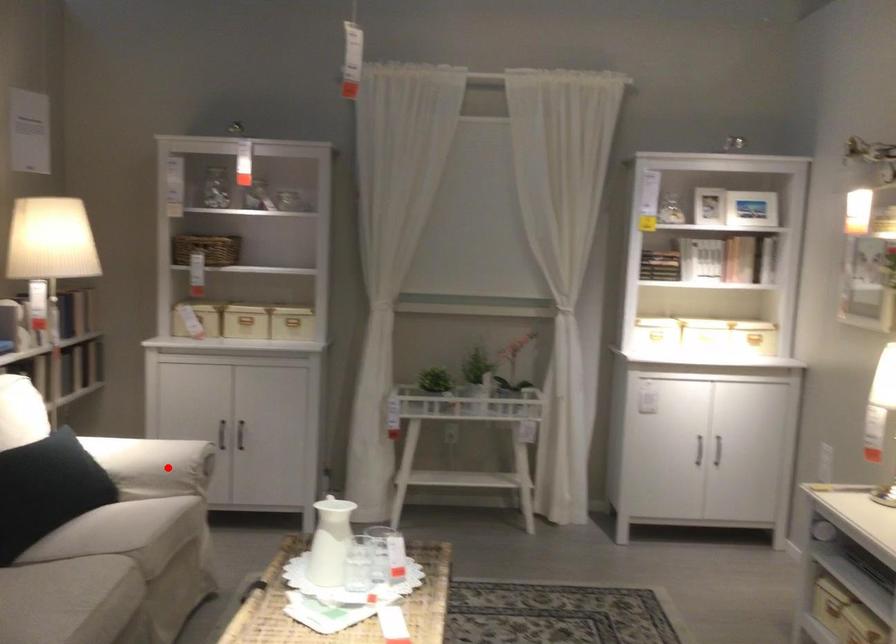
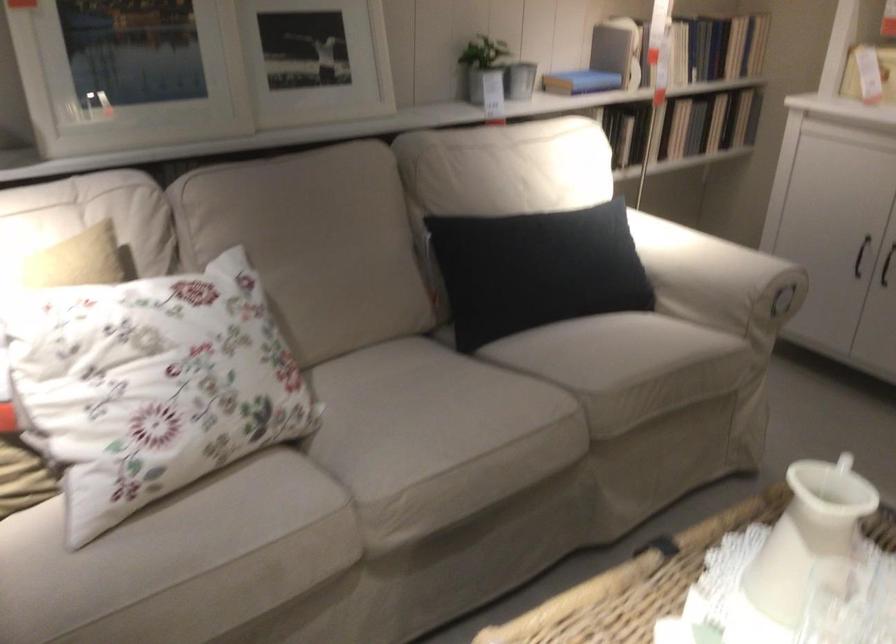
Find the pixel in the second image that matches the highlighted location in the first image.

(717, 279)